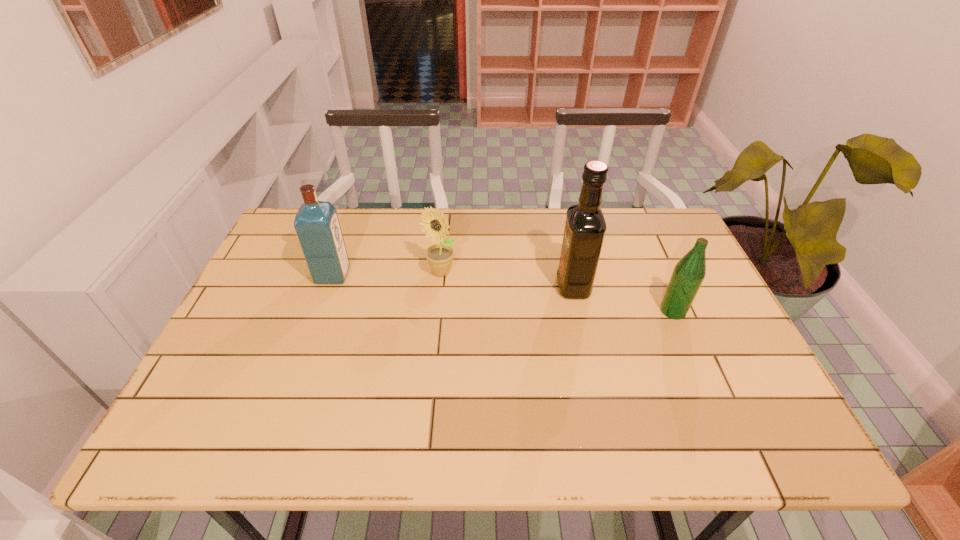
The height and width of the screenshot is (540, 960). What are the coordinates of `the tallest object` in the screenshot? It's located at (585, 227).

Find the location of a particular element. the taller liquor is located at coordinates (585, 227).

Locate an element on the screen. the leftmost object is located at coordinates (316, 223).

In order to click on the left liquor in this screenshot , I will do `click(316, 223)`.

I want to click on the rightmost object, so click(x=688, y=274).

This screenshot has width=960, height=540. In order to click on sunflower in this screenshot , I will do `click(440, 256)`.

I want to click on free space located on the front-facing side of the tallest object, so click(x=506, y=286).

I want to click on vacant space located 0.070m on the front-facing side of the tallest object, so click(x=531, y=286).

The height and width of the screenshot is (540, 960). I want to click on vacant space positioned on the front-facing side of the tallest object, so point(502,286).

This screenshot has width=960, height=540. Find the location of `vacant space located 0.360m on the flat label side of the third shortest object`. vacant space located 0.360m on the flat label side of the third shortest object is located at coordinates (476, 275).